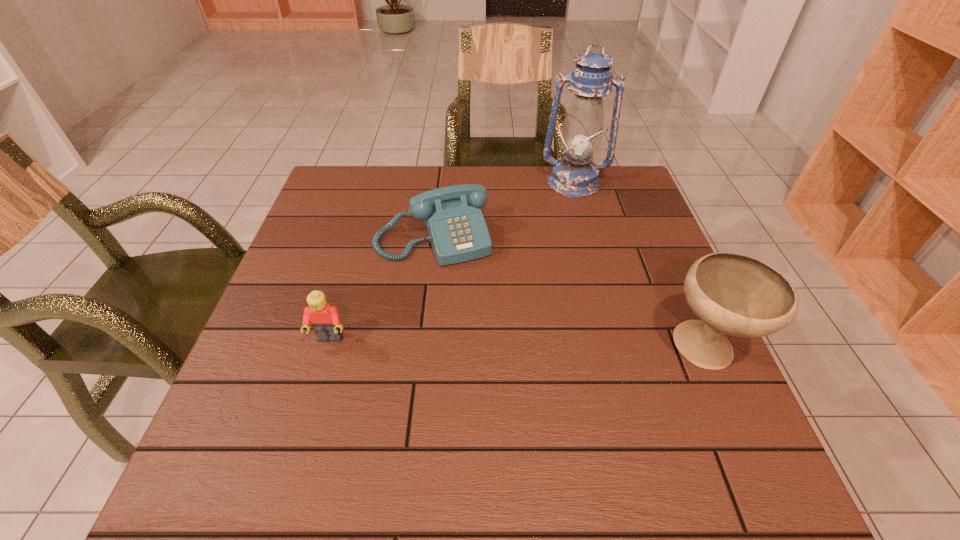
Find the location of `vacant space that is in between the chalice and the farthest object`. vacant space that is in between the chalice and the farthest object is located at coordinates (639, 266).

Locate an element on the screen. unoccupied position between the lantern and the telephone is located at coordinates (503, 210).

Identify the location of unoccupied position between the chalice and the second farthest object. (569, 293).

Where is `vacant area between the second tallest object and the telephone`? This screenshot has width=960, height=540. vacant area between the second tallest object and the telephone is located at coordinates (569, 293).

The height and width of the screenshot is (540, 960). Identify the location of vacant region between the chalice and the lantern. (639, 266).

Select which object is the closest to the second farthest object. Please provide its 2D coordinates. Your answer should be formatted as a tuple, i.e. [(x, y)], where the tuple contains the x and y coordinates of a point satisfying the conditions above.

[(575, 175)]

The width and height of the screenshot is (960, 540). In order to click on object that ranks as the third closest to the third shortest object in this screenshot , I will do `click(325, 320)`.

Find the location of a particular element. free spot that satisfies the following two spatial constraints: 1. on the front side of the chalice; 2. on the right side of the tallest object is located at coordinates (619, 349).

I want to click on free space that satisfies the following two spatial constraints: 1. on the face of the chalice; 2. on the right side of the Lego, so (x=326, y=349).

Where is `blank area in the image that satisfies the following two spatial constraints: 1. on the front side of the chalice; 2. on the left side of the farthest object`? The width and height of the screenshot is (960, 540). blank area in the image that satisfies the following two spatial constraints: 1. on the front side of the chalice; 2. on the left side of the farthest object is located at coordinates (619, 349).